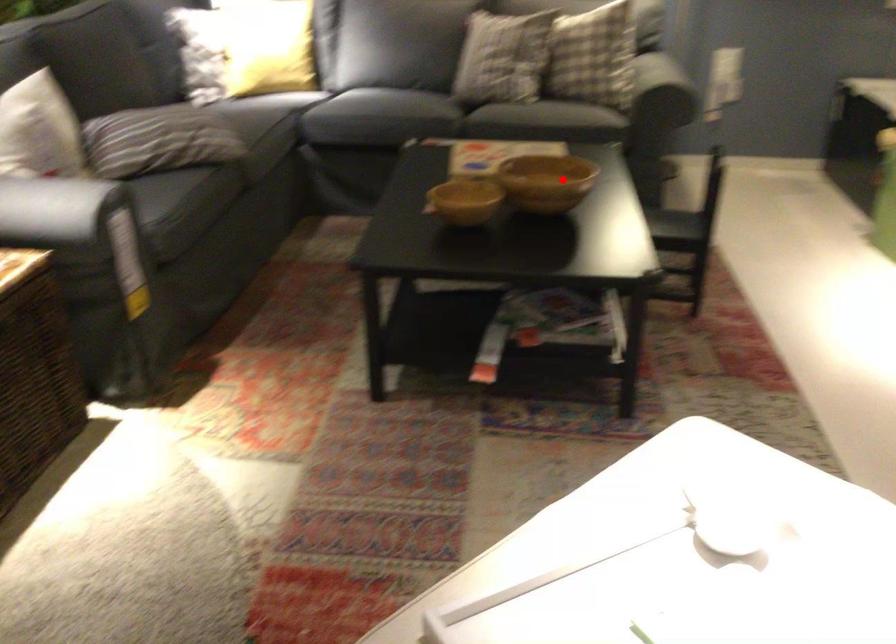
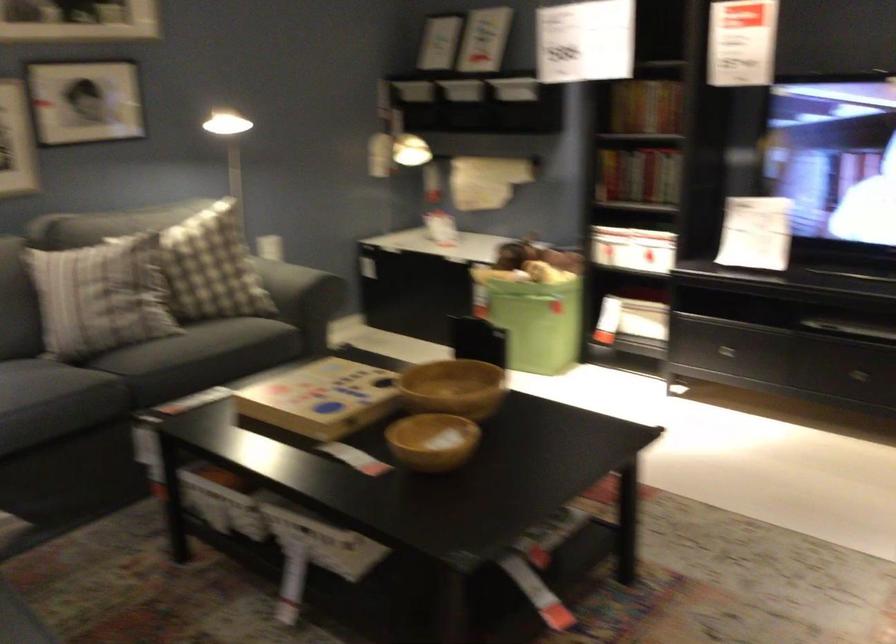
Question: I am providing you with two images of the same scene from different viewpoints. Given a red point in image1, look at the same physical point in image2. Is it:

Choices:
 (A) Closer to the viewpoint
 (B) Farther from the viewpoint

Answer: (A)